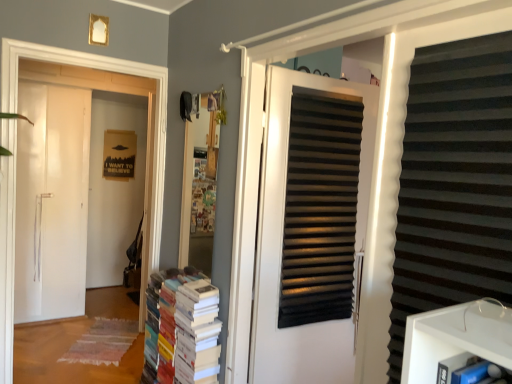
Question: Does white paper book at center have a lesser height compared to white matte door at left, which is the 2th door in front-to-back order?

Choices:
 (A) no
 (B) yes

Answer: (B)

Question: Is white paper book at center taller than white matte door at left, which is the 2th door in front-to-back order?

Choices:
 (A) yes
 (B) no

Answer: (B)

Question: Does white paper book at center turn towards white matte door at left, which is the 2th door in front-to-back order?

Choices:
 (A) yes
 (B) no

Answer: (B)

Question: Is white paper book at center beside white matte door at left, which ranks as the 1th door in back-to-front order?

Choices:
 (A) yes
 (B) no

Answer: (B)

Question: From a real-world perspective, is white paper book at center positioned over white matte door at left, placed as the second door when sorted from right to left, based on gravity?

Choices:
 (A) yes
 (B) no

Answer: (B)

Question: Is black matte shutter at right inside the boundaries of white matte door at left, positioned as the first door in left-to-right order, or outside?

Choices:
 (A) outside
 (B) inside

Answer: (A)

Question: Is black matte shutter at right in front of or behind white matte door at left, which ranks as the 1th door in back-to-front order, in the image?

Choices:
 (A) front
 (B) behind

Answer: (A)

Question: In terms of height, does black matte shutter at right look taller or shorter compared to white matte door at left, positioned as the first door in left-to-right order?

Choices:
 (A) tall
 (B) short

Answer: (B)

Question: In terms of width, does black matte shutter at right look wider or thinner when compared to white matte door at left, which is the 2th door in front-to-back order?

Choices:
 (A) thin
 (B) wide

Answer: (A)

Question: From the image's perspective, is white matte door at left, which ranks as the 1th door in back-to-front order, located above or below black matte door at center, the 2th door viewed from the back?

Choices:
 (A) above
 (B) below

Answer: (A)

Question: Relative to black matte door at center, which ranks as the second door in left-to-right order, is white matte door at left, positioned as the first door in left-to-right order, in front or behind?

Choices:
 (A) front
 (B) behind

Answer: (B)

Question: Considering the positions of point (141, 94) and point (349, 86), is point (141, 94) closer or farther from the camera than point (349, 86)?

Choices:
 (A) closer
 (B) farther

Answer: (B)

Question: In the image, is white matte door at left, positioned as the first door in left-to-right order, on the left side or the right side of black matte door at center, the first door when ordered from front to back?

Choices:
 (A) left
 (B) right

Answer: (A)

Question: From a real-world perspective, is white paper book at center positioned above or below white matte door at left, placed as the second door when sorted from right to left?

Choices:
 (A) below
 (B) above

Answer: (A)

Question: Is white paper book at center wider or thinner than white matte door at left, placed as the second door when sorted from right to left?

Choices:
 (A) thin
 (B) wide

Answer: (A)